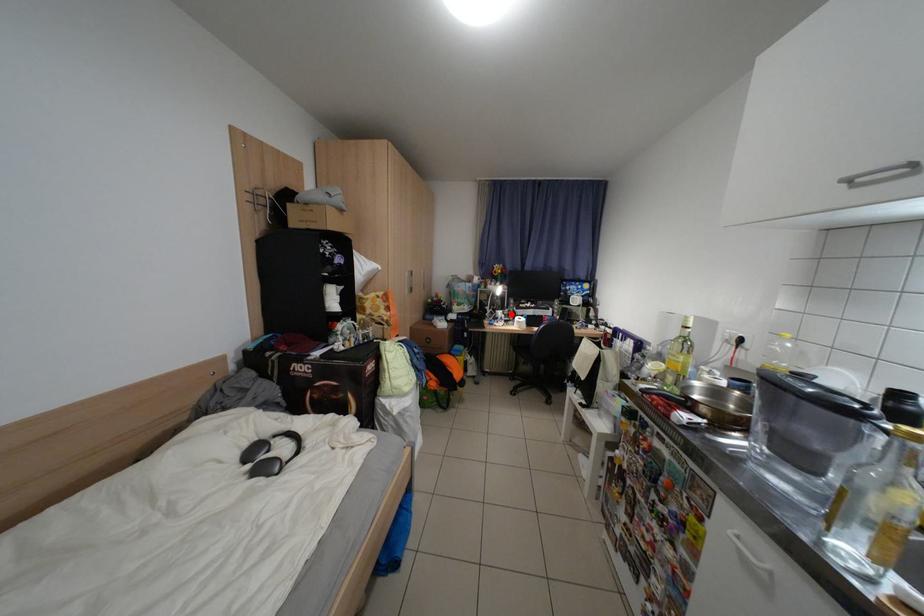
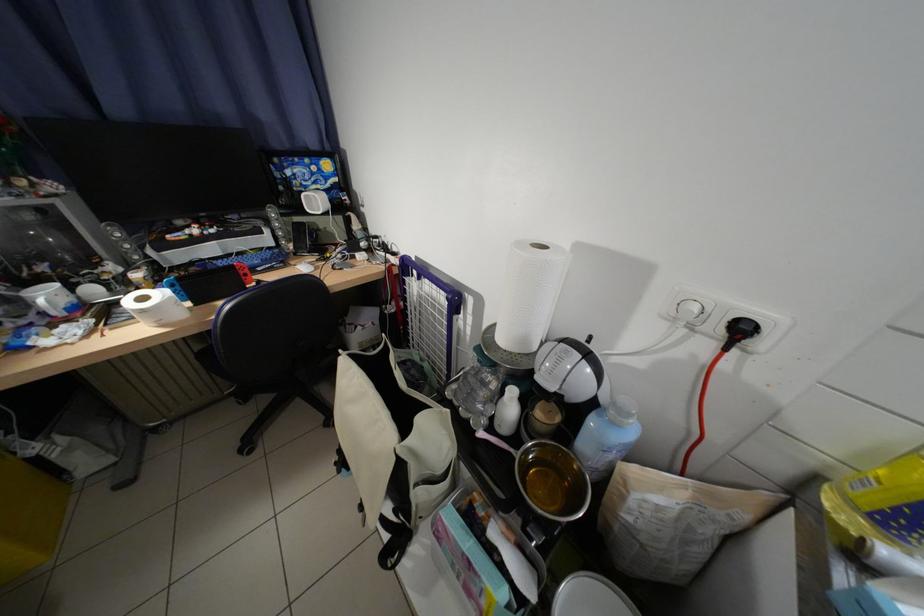
Where in the second image is the point corresponding to the highlighted location from the first image?

(59, 297)